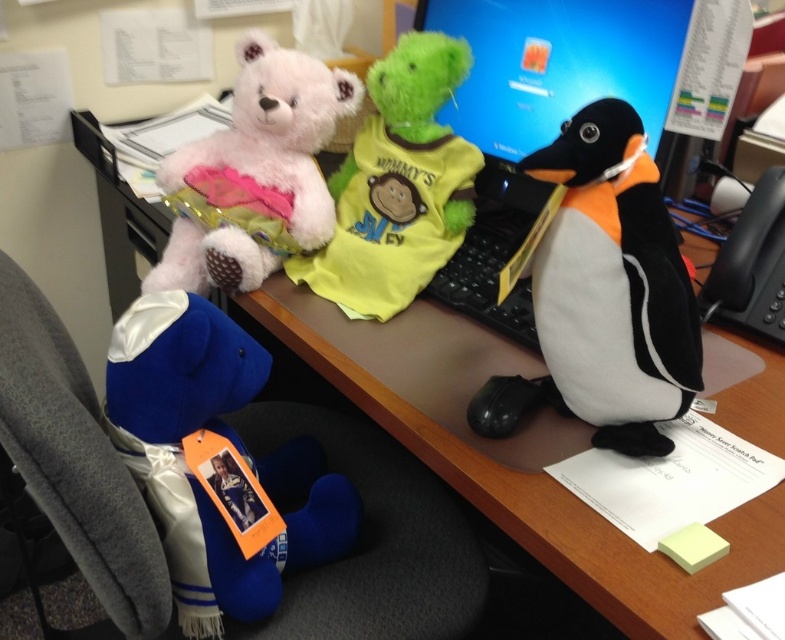
Question: Is blue satin teddy bear at lower left further to the viewer compared to black plush penguin at right?

Choices:
 (A) no
 (B) yes

Answer: (B)

Question: Is blue satin teddy bear at lower left thinner than fluffy pink bear at center?

Choices:
 (A) yes
 (B) no

Answer: (A)

Question: Does black plush penguin at right appear on the left side of fluffy pink bear at center?

Choices:
 (A) no
 (B) yes

Answer: (A)

Question: Which object is closer to the camera taking this photo?

Choices:
 (A) black plush penguin at right
 (B) fluffy white teddy bear at upper left

Answer: (A)

Question: Which object appears farthest from the camera in this image?

Choices:
 (A) fluffy pink bear at center
 (B) fluffy white teddy bear at upper left
 (C) black plush penguin at right
 (D) blue satin teddy bear at lower left

Answer: (B)

Question: Which point is farther to the camera?

Choices:
 (A) (192, 481)
 (B) (287, 164)

Answer: (B)